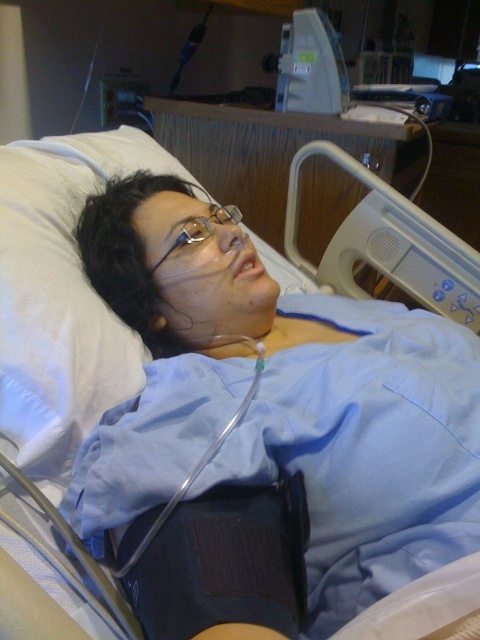
You are a nurse checking on a patient in the hospital. You see the white plastic hospital bed rail at upper right and the clear plastic glasses at center. Which object is positioned higher from the floor?

The white plastic hospital bed rail at upper right is above the clear plastic glasses at center, so it is higher from the floor.